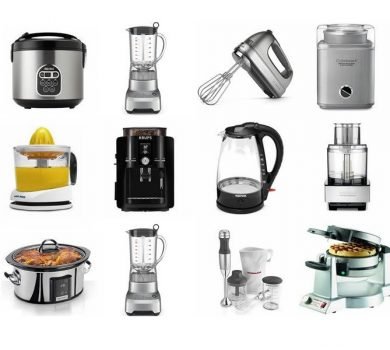
The image size is (390, 350). Identify the location of black cylindrical appliance. (144, 174).